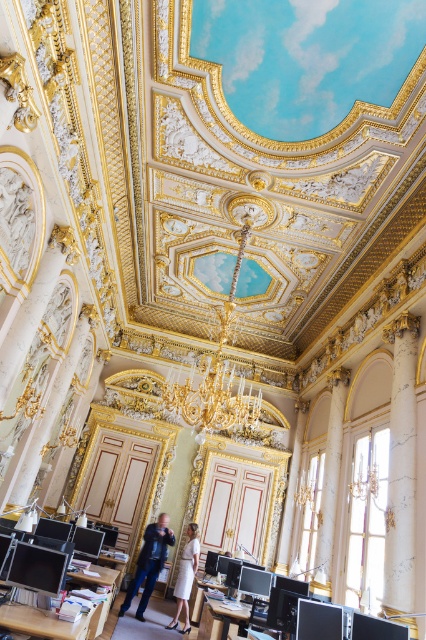
Question: Is gold metallic chandelier at center further to camera compared to white satin dress at center?

Choices:
 (A) yes
 (B) no

Answer: (A)

Question: Is gold metallic chandelier at center behind white satin dress at center?

Choices:
 (A) yes
 (B) no

Answer: (A)

Question: Which object appears farthest from the camera in this image?

Choices:
 (A) matte black jacket at center
 (B) white marble column at right
 (C) white marble pillar at center

Answer: (C)

Question: Does white marble column at right have a larger size compared to matte black jacket at center?

Choices:
 (A) yes
 (B) no

Answer: (A)

Question: Which object appears farthest from the camera in this image?

Choices:
 (A) gold metallic chandelier at center
 (B) white satin dress at center
 (C) white marble column at right
 (D) matte black jacket at center

Answer: (A)

Question: Which object appears closest to the camera in this image?

Choices:
 (A) matte black jacket at center
 (B) white marble pillar at center

Answer: (A)